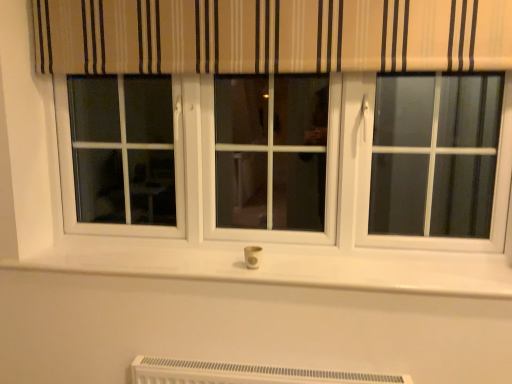
Question: Are white plastic heater at lower center and white plastic outlet at center making contact?

Choices:
 (A) no
 (B) yes

Answer: (A)

Question: Is white plastic heater at lower center positioned far away from white plastic outlet at center?

Choices:
 (A) no
 (B) yes

Answer: (A)

Question: From a real-world perspective, is white plastic heater at lower center located higher than white plastic outlet at center?

Choices:
 (A) yes
 (B) no

Answer: (B)

Question: Does white plastic heater at lower center appear on the right side of white plastic outlet at center?

Choices:
 (A) yes
 (B) no

Answer: (A)

Question: Is white plastic heater at lower center looking in the opposite direction of white plastic outlet at center?

Choices:
 (A) no
 (B) yes

Answer: (A)

Question: Can you confirm if white plastic heater at lower center is smaller than white plastic outlet at center?

Choices:
 (A) no
 (B) yes

Answer: (A)

Question: Would you say white plastic outlet at center contains white plastic heater at lower center?

Choices:
 (A) no
 (B) yes

Answer: (A)

Question: Is white plastic outlet at center looking in the opposite direction of white plastic heater at lower center?

Choices:
 (A) no
 (B) yes

Answer: (A)

Question: From a real-world perspective, is white plastic outlet at center positioned under white plastic heater at lower center based on gravity?

Choices:
 (A) no
 (B) yes

Answer: (A)

Question: Does white plastic outlet at center have a smaller size compared to white plastic heater at lower center?

Choices:
 (A) yes
 (B) no

Answer: (A)

Question: Does white plastic outlet at center have a lesser width compared to white plastic heater at lower center?

Choices:
 (A) no
 (B) yes

Answer: (B)

Question: Is white plastic outlet at center at the left side of white plastic heater at lower center?

Choices:
 (A) no
 (B) yes

Answer: (B)

Question: In terms of height, does white plastic outlet at center look taller or shorter compared to white plastic heater at lower center?

Choices:
 (A) short
 (B) tall

Answer: (A)